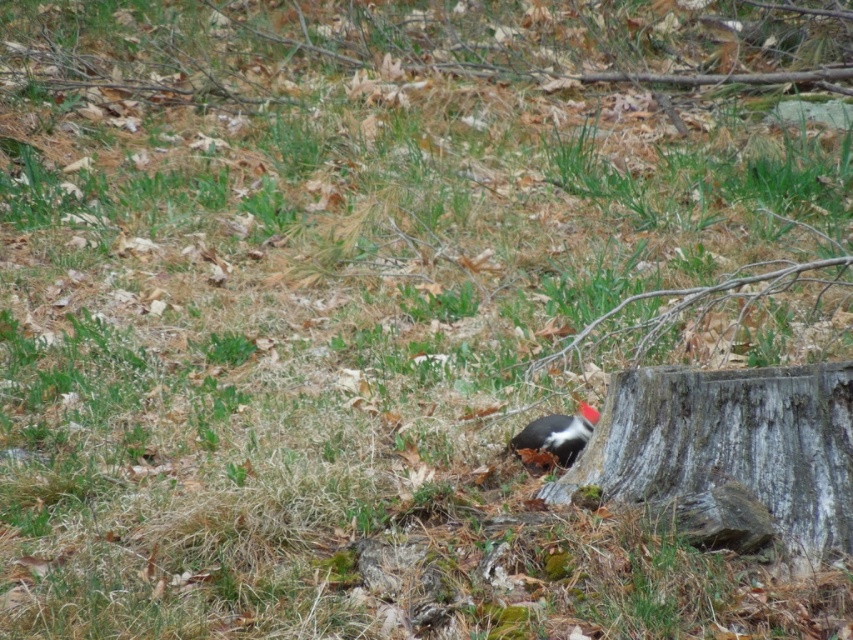
You are standing in the forest scene described. You notice the gray rough tree trunk at lower right. Based on its position, can you determine if it is closer to the woodpecker or farther away compared to the tree stump where the woodpecker is perched?

The gray rough tree trunk at lower right is located at point (730,444), which is farther away from the woodpecker than the tree stump it is perched on.

You are a birdwatcher observing the scene. You notice the gray rough tree trunk at lower right and the black matte woodpecker at center. Which object is wider in terms of their physical dimensions?

The gray rough tree trunk at lower right is wider than the black matte woodpecker at center according to the description.

You are a birdwatcher observing the scene. You see the gray rough tree trunk at lower right and the black matte woodpecker at center. Which object is located lower in the image?

The gray rough tree trunk at lower right is positioned under the black matte woodpecker at center, so it is located lower in the image.